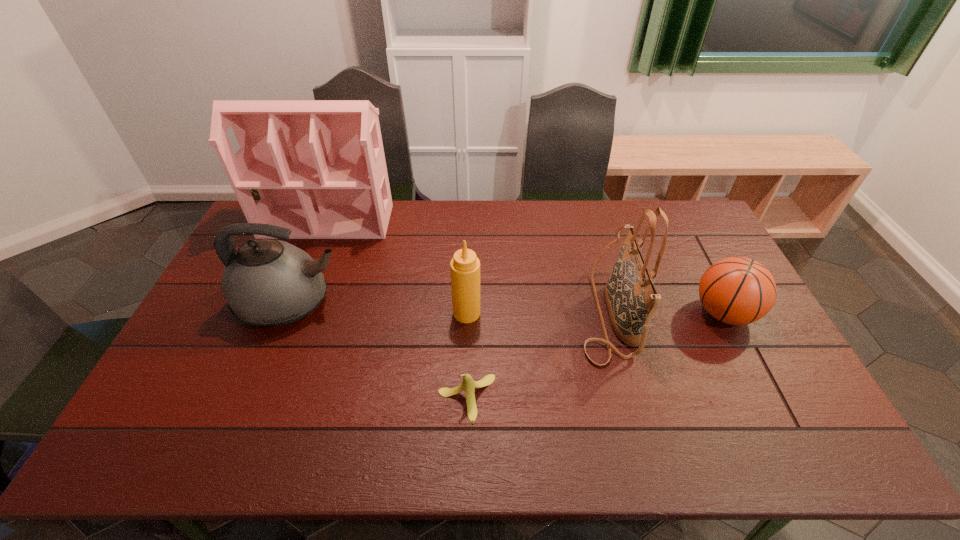
At what (x,y) coordinates should I click in order to perform the action: click on blank region between the fifth object from left to right and the banana. Please return your answer as a coordinate pair (x, y). The height and width of the screenshot is (540, 960). Looking at the image, I should click on (x=538, y=355).

At what (x,y) coordinates should I click in order to perform the action: click on free space between the basketball and the kettle. Please return your answer as a coordinate pair (x, y). This screenshot has height=540, width=960. Looking at the image, I should click on (508, 308).

Locate an element on the screen. vacant area between the rightmost object and the kettle is located at coordinates (508, 308).

Identify the location of vacant area between the nearest object and the second shortest object. (595, 356).

What are the coordinates of `free space between the condiment and the second object from right to left` in the screenshot? It's located at (538, 313).

Where is `vacant area that lies between the kettle and the fifth shortest object`? This screenshot has height=540, width=960. vacant area that lies between the kettle and the fifth shortest object is located at coordinates (450, 308).

Locate an element on the screen. The image size is (960, 540). free area in between the kettle and the fifth shortest object is located at coordinates (450, 308).

Where is `blank region between the condiment and the second object from right to left`? blank region between the condiment and the second object from right to left is located at coordinates (538, 313).

At what (x,y) coordinates should I click in order to perform the action: click on object that is the fifth closest to the condiment. Please return your answer as a coordinate pair (x, y). Looking at the image, I should click on (736, 290).

You are a GUI agent. You are given a task and a screenshot of the screen. Output one action in this format:
    pyautogui.click(x=<x>, y=<y>)
    Task: Click on the object that stands as the fourth closest to the banana
    
    Given the screenshot: What is the action you would take?
    pyautogui.click(x=319, y=167)